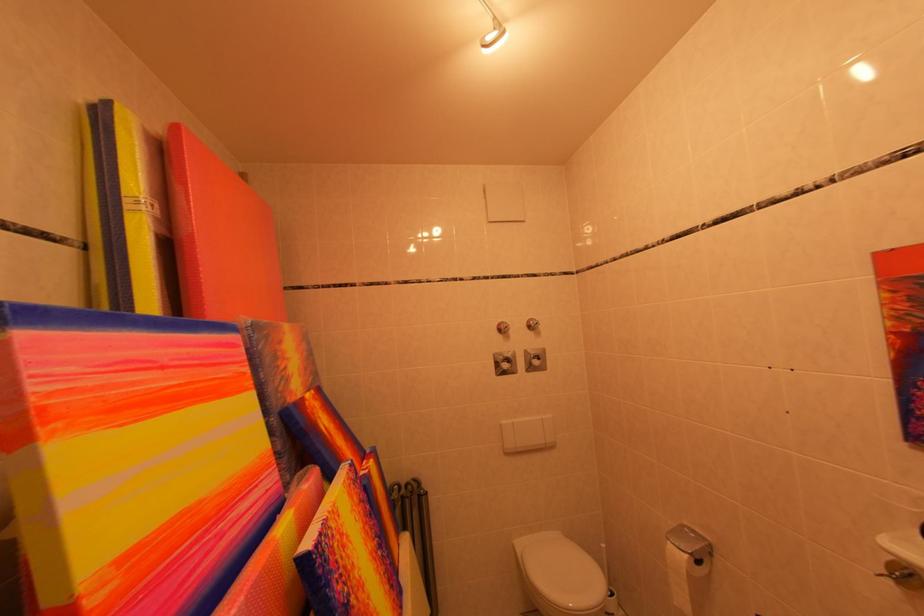
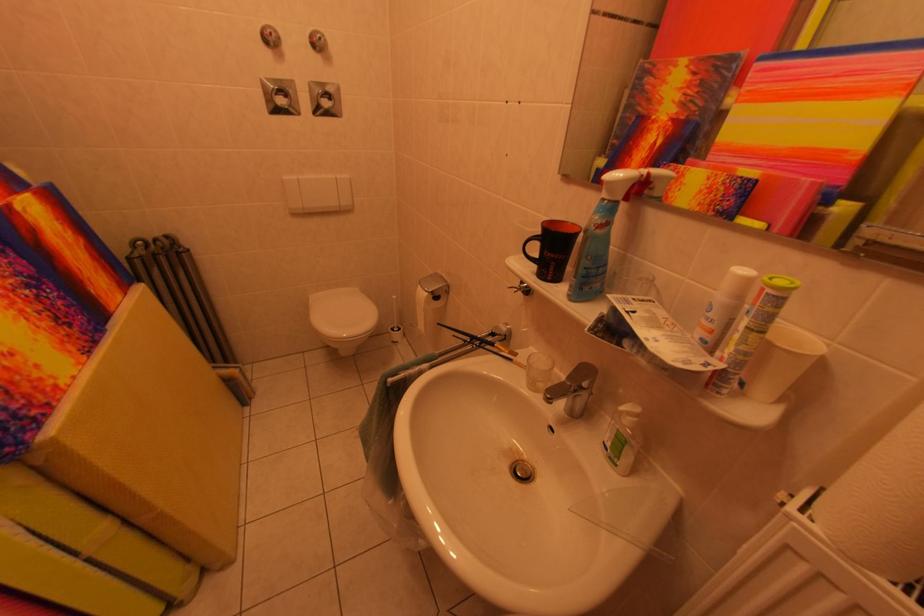
First-person continuous shooting, in which direction is the camera rotating?

The camera rotated toward right-down.